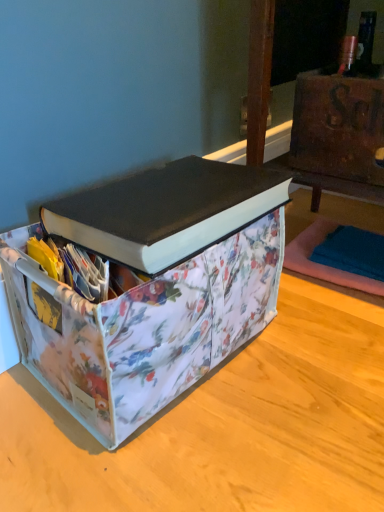
Question: Relative to floral fabric storage bin at center, is black matte book at upper center in front or behind?

Choices:
 (A) behind
 (B) front

Answer: (A)

Question: From a real-world perspective, relative to floral fabric storage bin at center, is black matte book at upper center vertically above or below?

Choices:
 (A) above
 (B) below

Answer: (A)

Question: Which object is positioned farthest from the teal fabric yoga mat at lower right?

Choices:
 (A) floral fabric storage bin at center
 (B) rusty metal chest at upper right
 (C) floral fabric storage bin at lower right
 (D) black matte book at upper center

Answer: (A)

Question: Based on their relative distances, which object is farther from the rusty metal chest at upper right?

Choices:
 (A) floral fabric storage bin at center
 (B) black matte book at upper center
 (C) floral fabric storage bin at lower right
 (D) teal fabric yoga mat at lower right

Answer: (A)